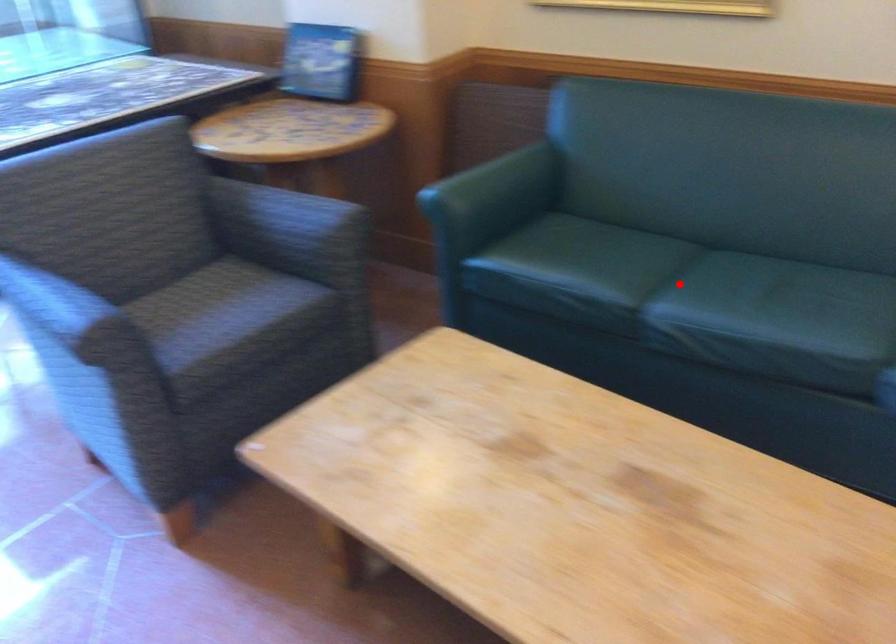
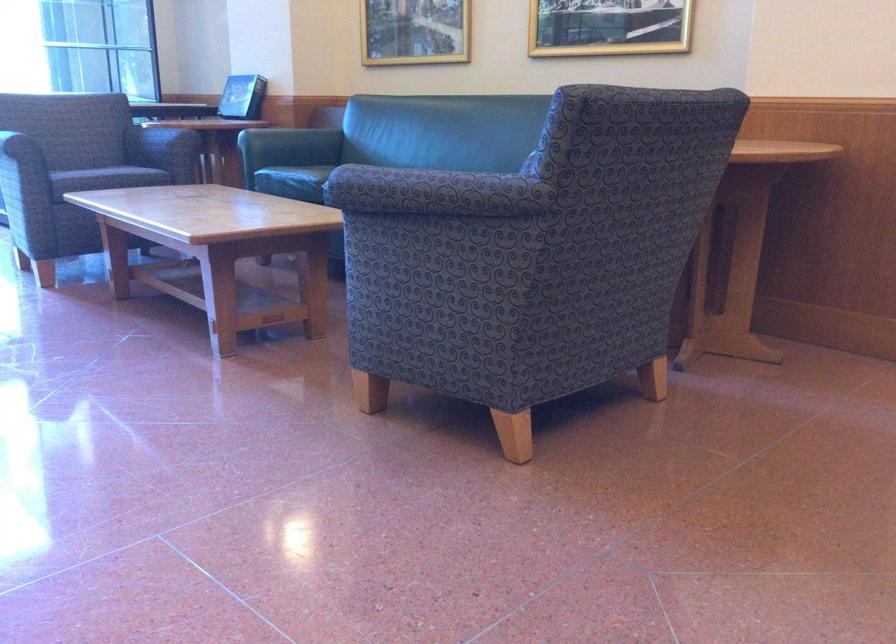
Question: I am providing you with two images of the same scene from different viewpoints. A red point is marked on the first image. Is the red point's position out of view in image 2?

Choices:
 (A) Yes
 (B) No

Answer: (A)